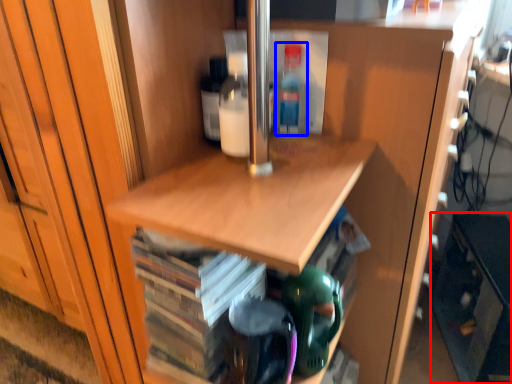
Question: Which object is further to the camera taking this photo, cabinetry (highlighted by a red box) or bottle (highlighted by a blue box)?

Choices:
 (A) cabinetry
 (B) bottle

Answer: (A)